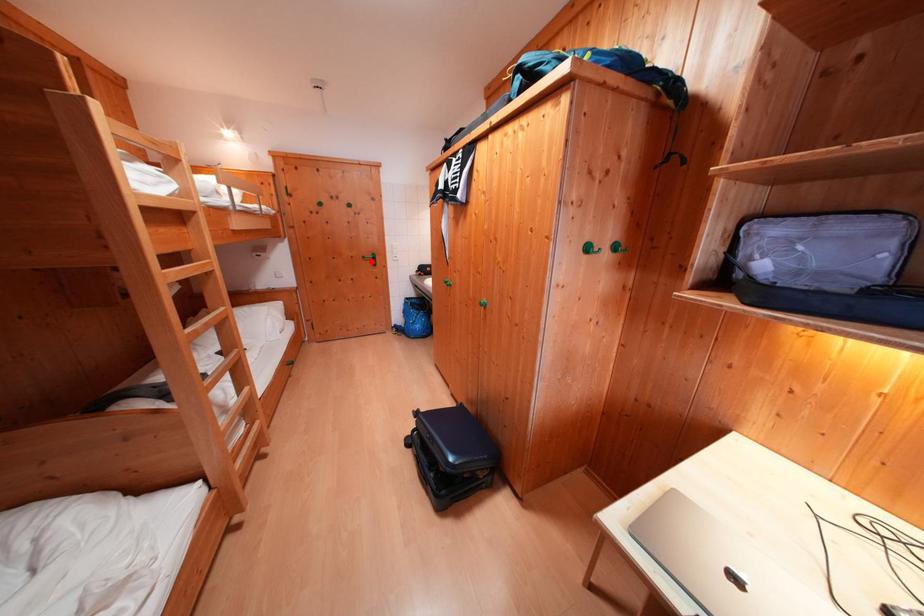
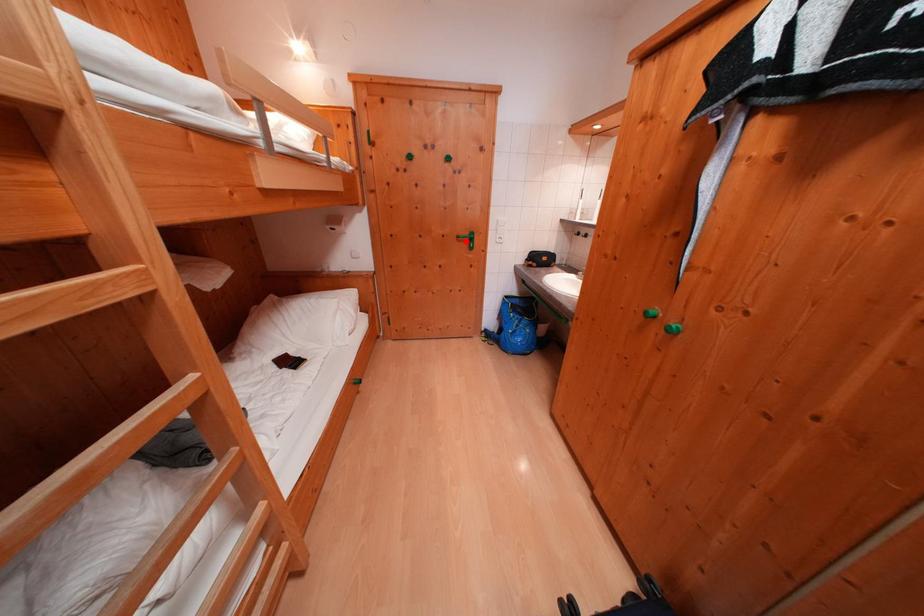
I am providing you with two images of the same scene from different viewpoints. A red point is marked on the first image and another point is marked on the second image. Are the points marked in image1 and image2 representing the same 3D position?

Yes